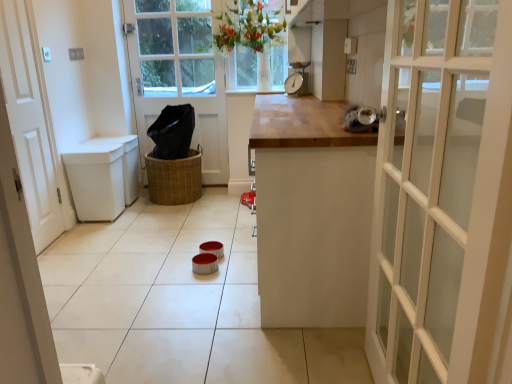
Locate an element on the screen. The image size is (512, 384). free space above white wooden door at center, the 2th door positioned from the front (from a real-world perspective) is located at coordinates (165, 0).